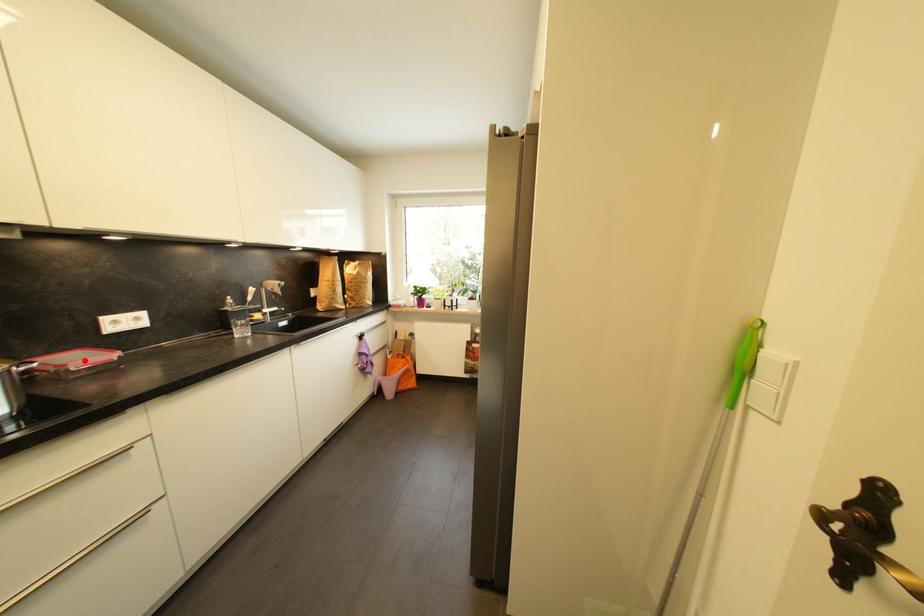
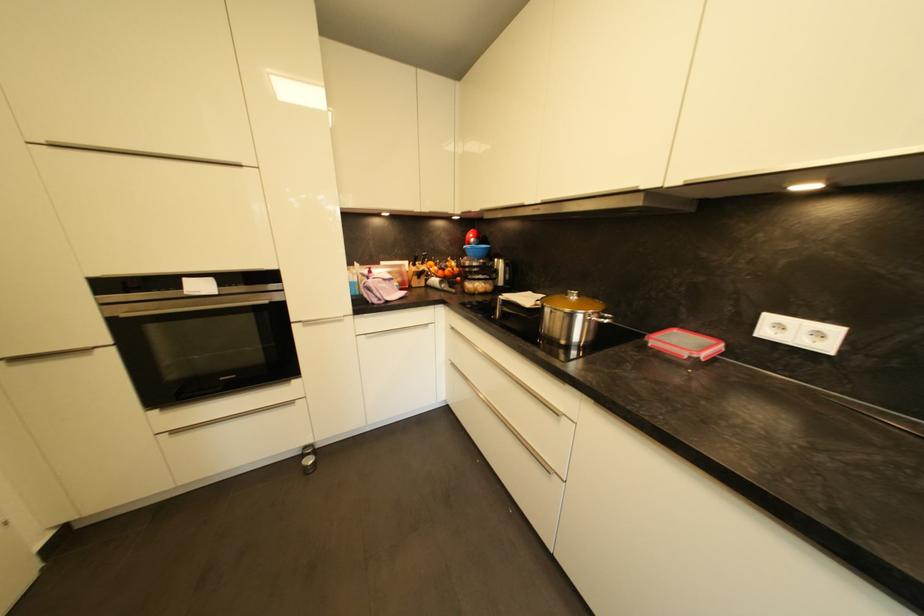
Find the pixel in the second image that matches the highlighted location in the first image.

(686, 345)